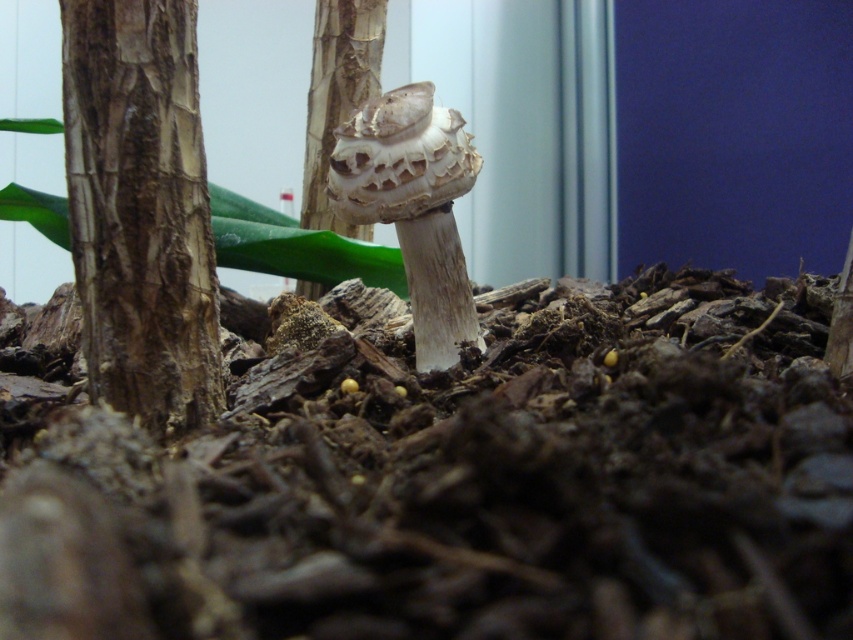
Question: In this image, where is brown textured bark at left located relative to smooth bark tree trunk at center?

Choices:
 (A) left
 (B) right

Answer: (A)

Question: From the image, what is the correct spatial relationship of brown textured bark at left in relation to smooth bark tree trunk at center?

Choices:
 (A) left
 (B) right

Answer: (A)

Question: Does brown textured bark at left have a lesser width compared to smooth bark tree trunk at center?

Choices:
 (A) no
 (B) yes

Answer: (B)

Question: Which point is farther to the camera?

Choices:
 (A) (119, 404)
 (B) (331, 38)

Answer: (B)

Question: Among these points, which one is nearest to the camera?

Choices:
 (A) (373, 61)
 (B) (213, 260)

Answer: (B)